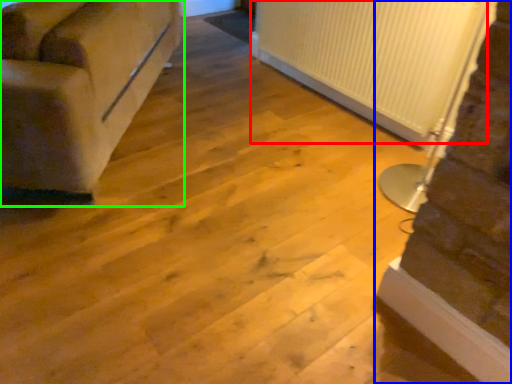
Question: Considering the real-world distances, which object is farthest from radiator (highlighted by a red box)? stairwell (highlighted by a blue box) or studio couch (highlighted by a green box)?

Choices:
 (A) stairwell
 (B) studio couch

Answer: (B)